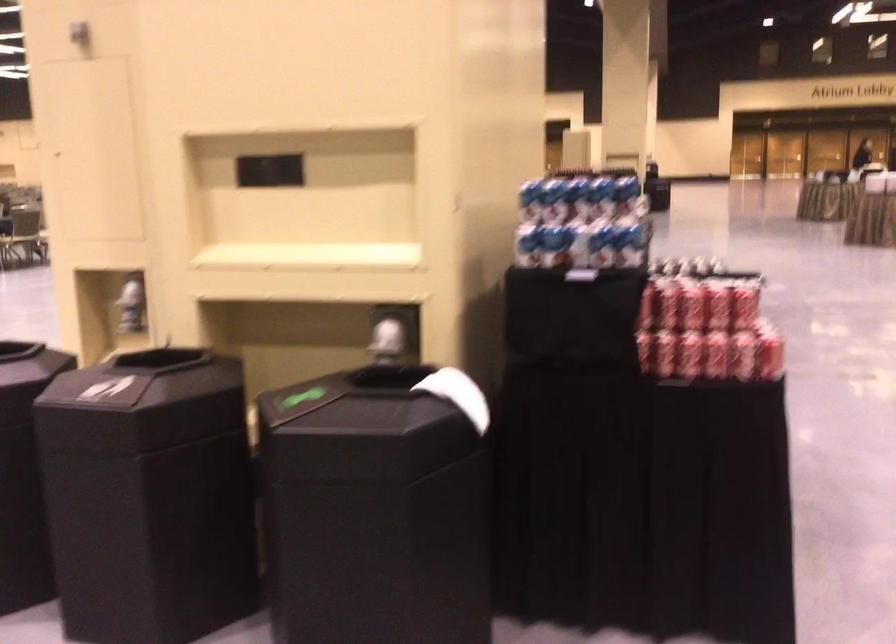
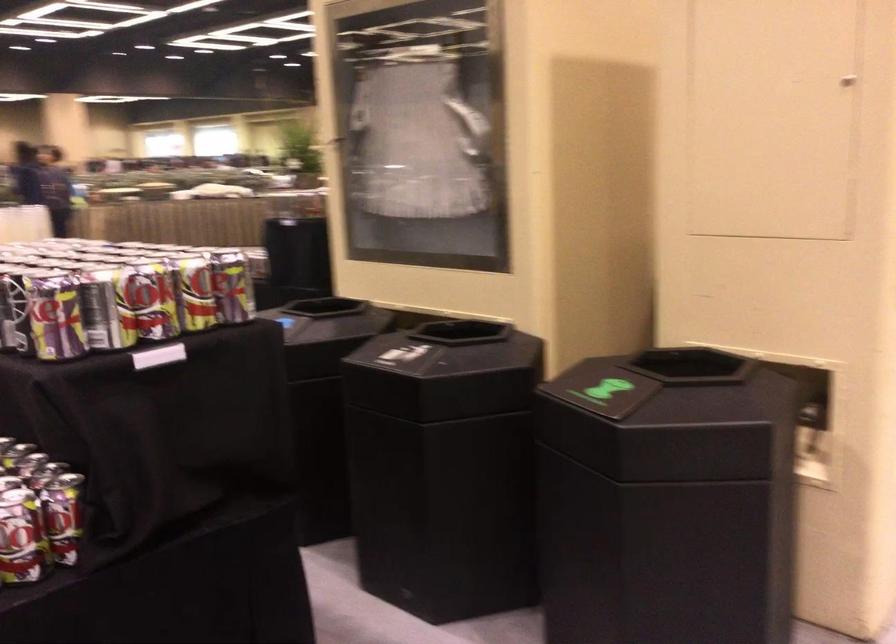
Question: I am providing you with two images of the same scene from different viewpoints. Which of the following objects are not visible in image2?

Choices:
 (A) black leather stool
 (B) beverage can
 (C) black bin opening
 (D) blue and white can

Answer: (D)